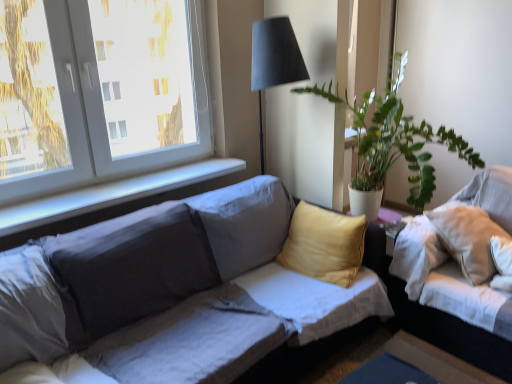
Question: Does green leafy plant at upper right turn towards white plastic window at upper left?

Choices:
 (A) yes
 (B) no

Answer: (B)

Question: Is green leafy plant at upper right next to white plastic window at upper left?

Choices:
 (A) yes
 (B) no

Answer: (B)

Question: From a real-world perspective, is green leafy plant at upper right physically below white plastic window at upper left?

Choices:
 (A) no
 (B) yes

Answer: (B)

Question: Is green leafy plant at upper right positioned behind white plastic window at upper left?

Choices:
 (A) no
 (B) yes

Answer: (A)

Question: Is green leafy plant at upper right closer to the viewer compared to white plastic window at upper left?

Choices:
 (A) no
 (B) yes

Answer: (B)

Question: Is green leafy plant at upper right to the left of white plastic window at upper left from the viewer's perspective?

Choices:
 (A) no
 (B) yes

Answer: (A)

Question: Is the position of white fabric couch at right, the 1th studio couch positioned from the right, more distant than that of white plastic window at upper left?

Choices:
 (A) no
 (B) yes

Answer: (A)

Question: Can you confirm if white fabric couch at right, marked as the 2th studio couch in a left-to-right arrangement, is smaller than white plastic window at upper left?

Choices:
 (A) no
 (B) yes

Answer: (A)

Question: Is white fabric couch at right, the 1th studio couch positioned from the right, next to white plastic window at upper left?

Choices:
 (A) no
 (B) yes

Answer: (A)

Question: Is white fabric couch at right, marked as the 2th studio couch in a left-to-right arrangement, taller than white plastic window at upper left?

Choices:
 (A) yes
 (B) no

Answer: (B)

Question: Is white fabric couch at right, marked as the 2th studio couch in a left-to-right arrangement, thinner than white plastic window at upper left?

Choices:
 (A) yes
 (B) no

Answer: (B)

Question: From a real-world perspective, is white plastic window at upper left beneath white smooth window sill at upper left?

Choices:
 (A) yes
 (B) no

Answer: (B)